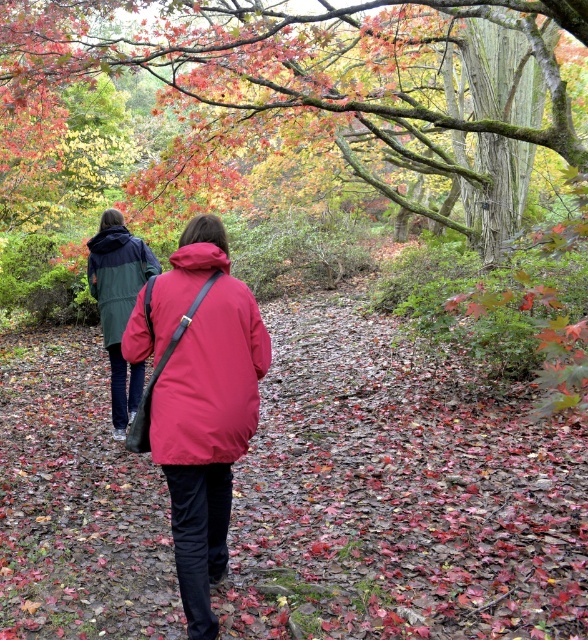
In the scene shown: You are standing at the camera position and want to take a photo of the smooth bark tree at upper center. If your camera has a maximum focus range of 5 meters, will it be able to capture the tree clearly?

The smooth bark tree at upper center is 4.77 meters from camera, so yes, the camera can focus on it since the distance is within the 5 meters maximum range.